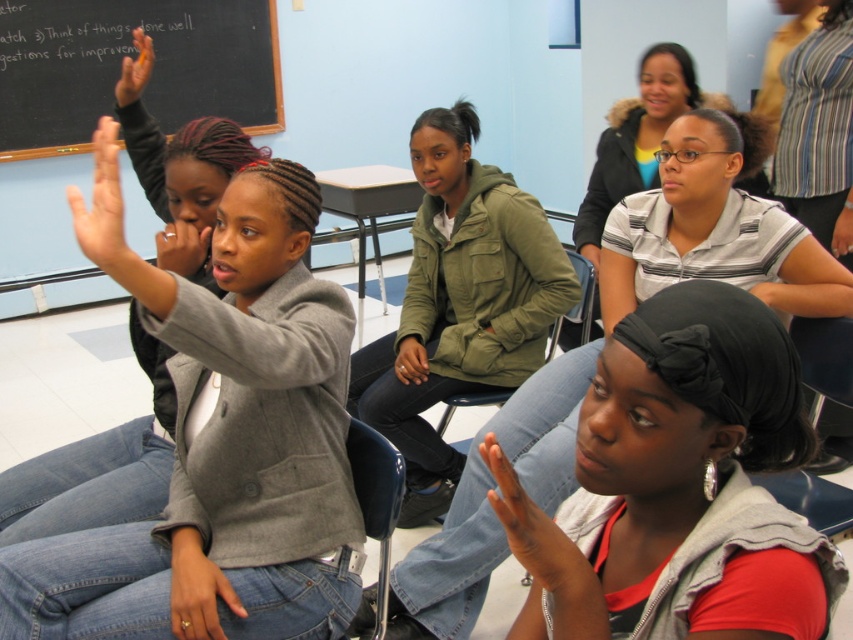
Is gray wool blazer at center to the left of reddish-brown fabric headscarf at lower right from the viewer's perspective?

Indeed, gray wool blazer at center is positioned on the left side of reddish-brown fabric headscarf at lower right.

Does gray wool blazer at center have a lesser height compared to reddish-brown fabric headscarf at lower right?

In fact, gray wool blazer at center may be taller than reddish-brown fabric headscarf at lower right.

Describe the element at coordinates (225, 454) in the screenshot. I see `gray wool blazer at center` at that location.

Where is `gray wool blazer at center`? Image resolution: width=853 pixels, height=640 pixels. gray wool blazer at center is located at coordinates (225, 454).

Which is above, olive green jacket at center or smooth skin hand at lower center?

olive green jacket at center is above.

Which is in front, point (469, 128) or point (506, 536)?

Positioned in front is point (506, 536).

Is point (482, 250) closer to camera compared to point (567, 550)?

No, (482, 250) is further to viewer.

Locate an element on the screen. The width and height of the screenshot is (853, 640). olive green jacket at center is located at coordinates [x=459, y=305].

Between black chalkboard at upper left and striped polo shirt at upper right, which one has less height?

striped polo shirt at upper right

Does black chalkboard at upper left have a lesser width compared to striped polo shirt at upper right?

In fact, black chalkboard at upper left might be wider than striped polo shirt at upper right.

Who is more distant from viewer, (x=265, y=77) or (x=624, y=100)?

The point (x=265, y=77) is more distant.

The image size is (853, 640). I want to click on black chalkboard at upper left, so click(119, 67).